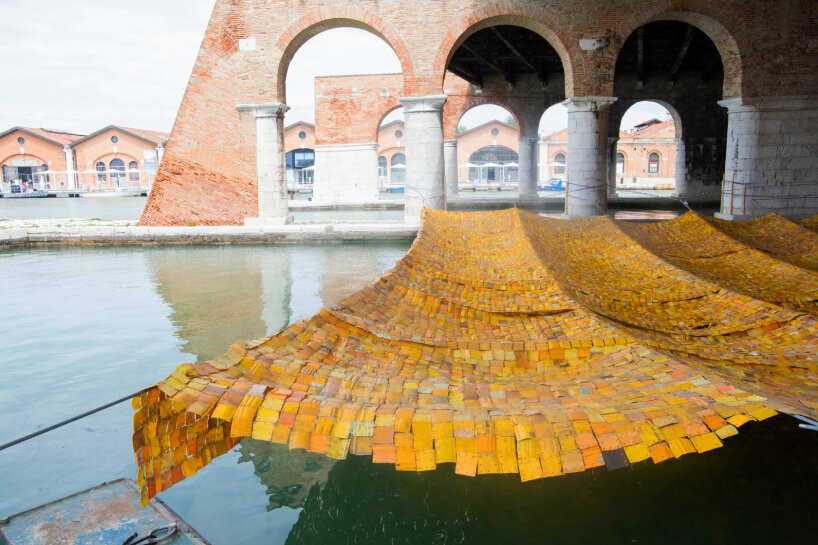
Find the location of `pillars`. pillars is located at coordinates (589, 131), (424, 165), (448, 160), (526, 175), (268, 171).